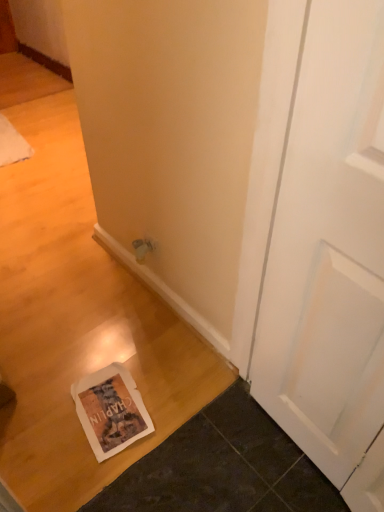
Image resolution: width=384 pixels, height=512 pixels. I want to click on free spot below white matte door at center (from a real-world perspective), so click(298, 459).